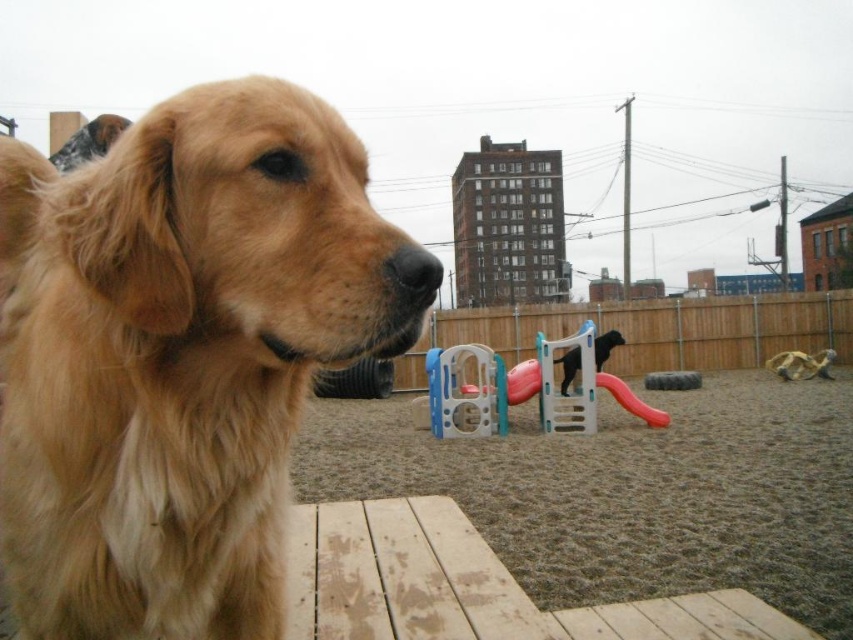
Which is below, golden fur dog at left or brown fur dog at upper left?

golden fur dog at left

Does point (279, 81) come closer to viewer compared to point (105, 141)?

Yes.

In order to click on golden fur dog at left in this screenshot , I will do `click(180, 355)`.

Locate an element on the screen. brown fur dog at upper left is located at coordinates (90, 141).

This screenshot has width=853, height=640. Identify the location of brown fur dog at upper left. (90, 141).

Image resolution: width=853 pixels, height=640 pixels. Find the location of `brown fur dog at upper left`. brown fur dog at upper left is located at coordinates (90, 141).

Is rubber rope toy at lower right further to camera compared to black rubber dog at center?

Yes, it is behind black rubber dog at center.

The height and width of the screenshot is (640, 853). What do you see at coordinates (801, 364) in the screenshot?
I see `rubber rope toy at lower right` at bounding box center [801, 364].

Between point (827, 353) and point (608, 342), which one is positioned in front?

Point (608, 342)

What are the coordinates of `rubber rope toy at lower right` in the screenshot? It's located at [x=801, y=364].